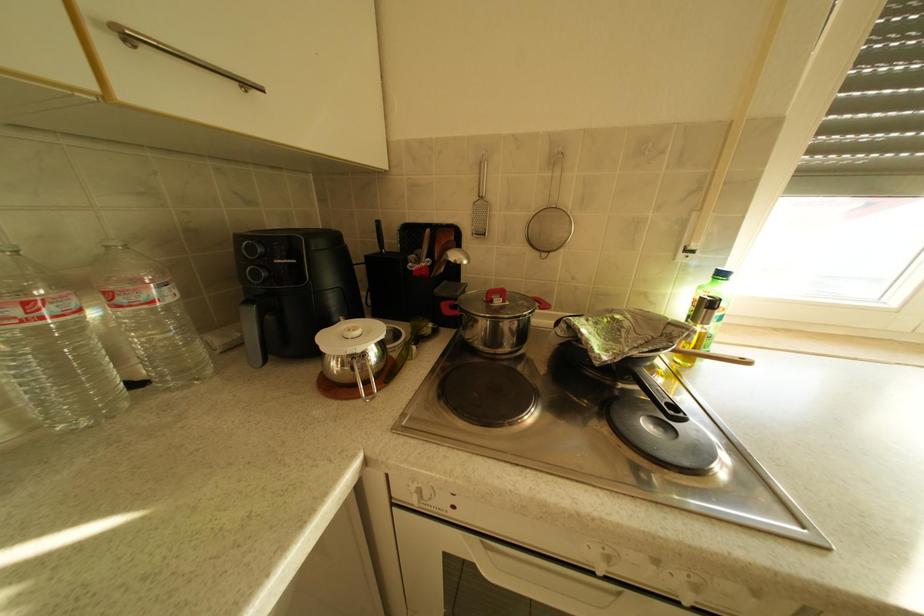
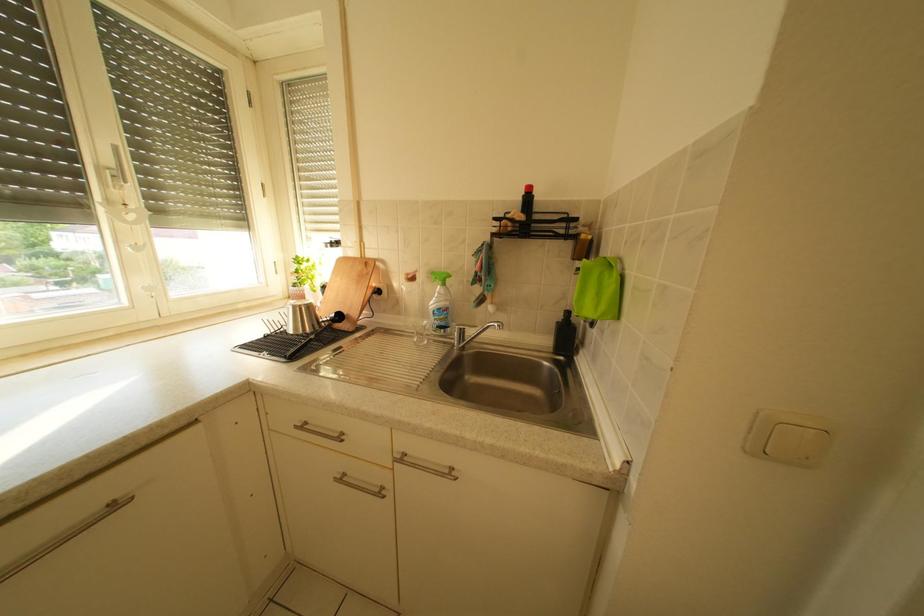
Question: The first image is from the beginning of the video and the second image is from the end. How did the camera likely rotate when shooting the video?

Choices:
 (A) Left
 (B) Right
 (C) Up
 (D) Down

Answer: (B)